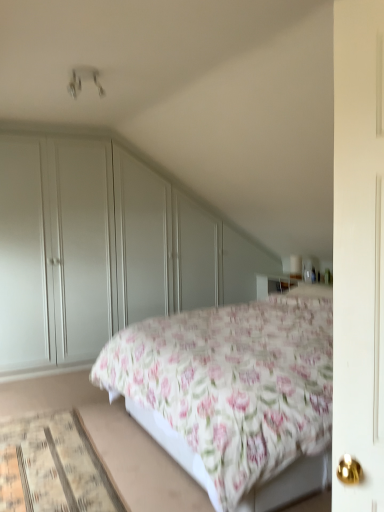
Question: Is floral cotton bed at center shorter than matte white wardrobe at left?

Choices:
 (A) no
 (B) yes

Answer: (B)

Question: From a real-world perspective, is floral cotton bed at center physically below matte white wardrobe at left?

Choices:
 (A) no
 (B) yes

Answer: (B)

Question: Is floral cotton bed at center positioned behind matte white wardrobe at left?

Choices:
 (A) no
 (B) yes

Answer: (A)

Question: Is the surface of floral cotton bed at center in direct contact with matte white wardrobe at left?

Choices:
 (A) no
 (B) yes

Answer: (A)

Question: From a real-world perspective, is floral cotton bed at center located higher than matte white wardrobe at left?

Choices:
 (A) yes
 (B) no

Answer: (B)

Question: Is there a large distance between floral cotton bed at center and matte white wardrobe at left?

Choices:
 (A) no
 (B) yes

Answer: (B)

Question: Is matte white wardrobe at left facing away from floral cotton bed at center?

Choices:
 (A) yes
 (B) no

Answer: (B)

Question: Is matte white wardrobe at left aimed at floral cotton bed at center?

Choices:
 (A) no
 (B) yes

Answer: (B)

Question: Can you confirm if matte white wardrobe at left is taller than floral cotton bed at center?

Choices:
 (A) yes
 (B) no

Answer: (A)

Question: Is matte white wardrobe at left bigger than floral cotton bed at center?

Choices:
 (A) yes
 (B) no

Answer: (B)

Question: Does matte white wardrobe at left have a smaller size compared to floral cotton bed at center?

Choices:
 (A) yes
 (B) no

Answer: (A)

Question: Is matte white wardrobe at left placed right next to floral cotton bed at center?

Choices:
 (A) no
 (B) yes

Answer: (A)

Question: Can you confirm if floral cotton bed at center is positioned to the left of beige woven mat at lower left?

Choices:
 (A) yes
 (B) no

Answer: (B)